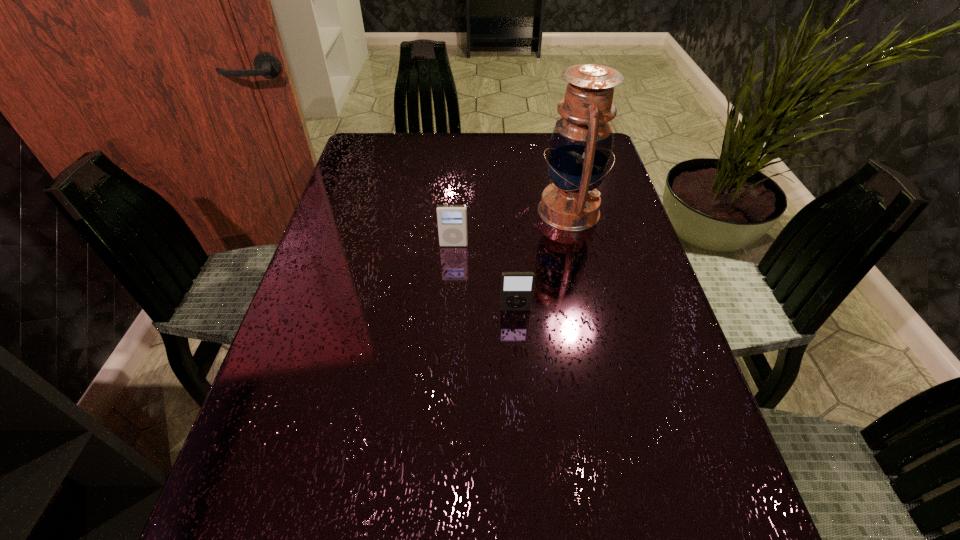
Where is `oil lamp`? The height and width of the screenshot is (540, 960). oil lamp is located at coordinates point(580,149).

Locate an element on the screen. The width and height of the screenshot is (960, 540). the tallest object is located at coordinates (580, 149).

I want to click on the farther iPod, so (452, 219).

Find the location of a particular element. Image resolution: width=960 pixels, height=540 pixels. the second farthest object is located at coordinates (452, 219).

Where is `the right iPod`? This screenshot has height=540, width=960. the right iPod is located at coordinates (517, 288).

Find the location of a particular element. the nearest object is located at coordinates (517, 288).

Image resolution: width=960 pixels, height=540 pixels. Identify the location of blank area located 0.170m on the back of the oil lamp. (556, 156).

Where is `free region located 0.250m on the front-facing side of the leftmost object`? The width and height of the screenshot is (960, 540). free region located 0.250m on the front-facing side of the leftmost object is located at coordinates (448, 329).

I want to click on free space located on the front-facing side of the nearer iPod, so click(525, 447).

Where is `object that is at the right edge`? object that is at the right edge is located at coordinates tap(580, 149).